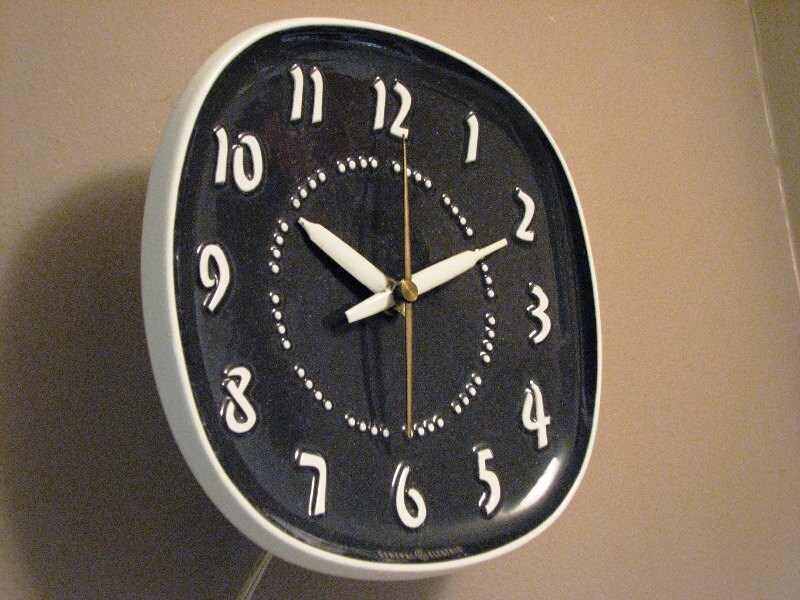
Locate an element on the screen. clock is located at coordinates (374, 221).